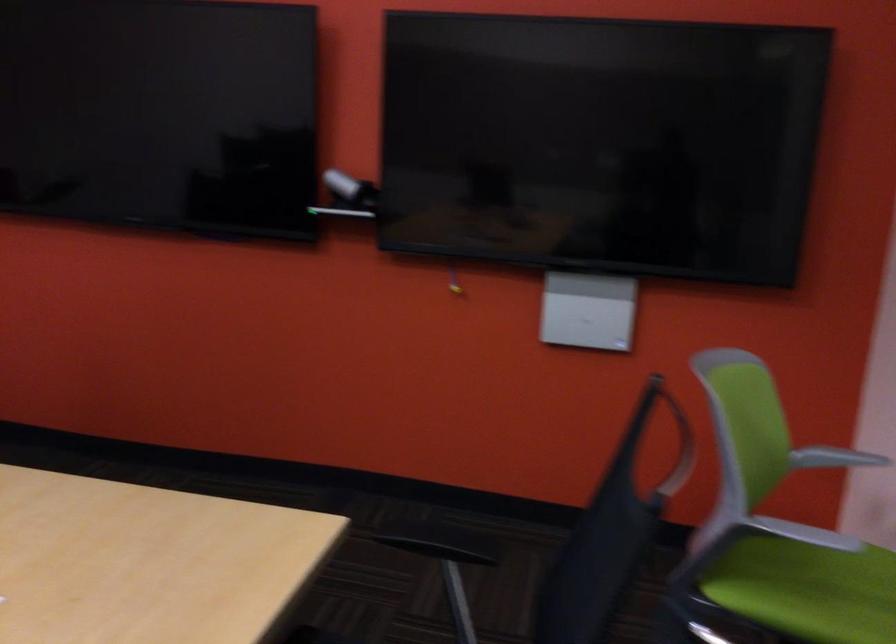
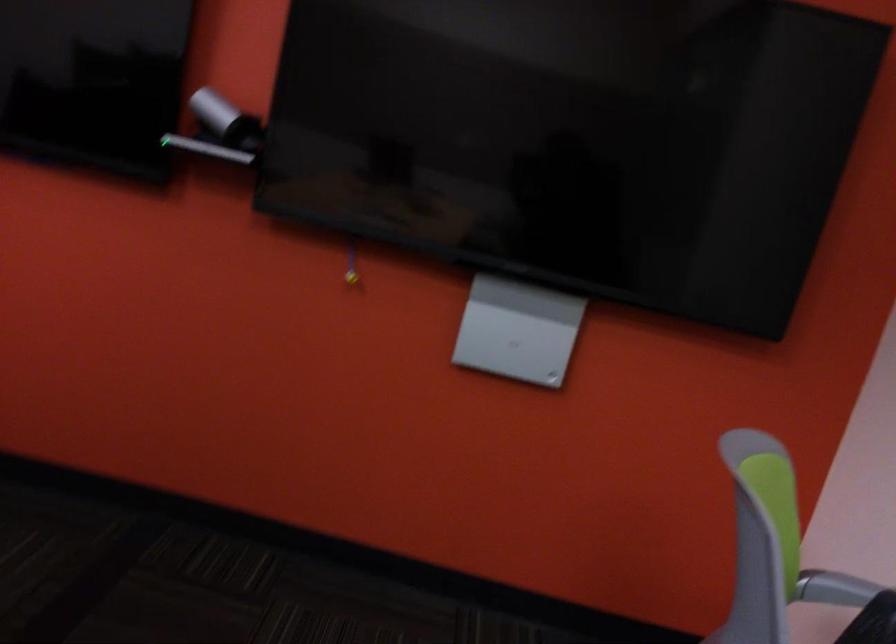
Question: In a continuous first-person perspective shot, in which direction is the camera moving?

Choices:
 (A) Left
 (B) Right
 (C) Forward
 (D) Backward

Answer: (C)